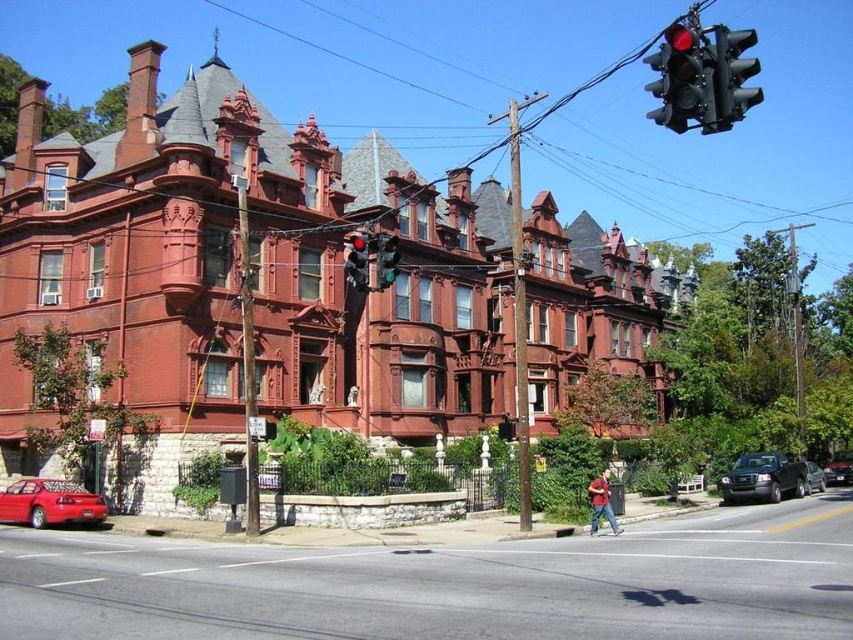
Question: Is red brick sidewalk at lower center to the left of matte black traffic light at center from the viewer's perspective?

Choices:
 (A) no
 (B) yes

Answer: (A)

Question: Does red brick sidewalk at lower center have a greater width compared to metallic silver sedan at lower right?

Choices:
 (A) no
 (B) yes

Answer: (B)

Question: Which point is closer to the camera?

Choices:
 (A) (360, 230)
 (B) (775, 474)

Answer: (B)

Question: Is reddish-brown leather jacket at lower right to the right of shiny black sedan at center right from the viewer's perspective?

Choices:
 (A) yes
 (B) no

Answer: (B)

Question: Based on their relative distances, which object is farther from the shiny black sedan at center right?

Choices:
 (A) red brick sidewalk at lower center
 (B) green glass traffic light at center

Answer: (B)

Question: Estimate the real-world distances between objects in this image. Which object is closer to the metallic silver sedan at lower right?

Choices:
 (A) black metallic traffic light at upper right
 (B) green glass traffic light at center

Answer: (B)